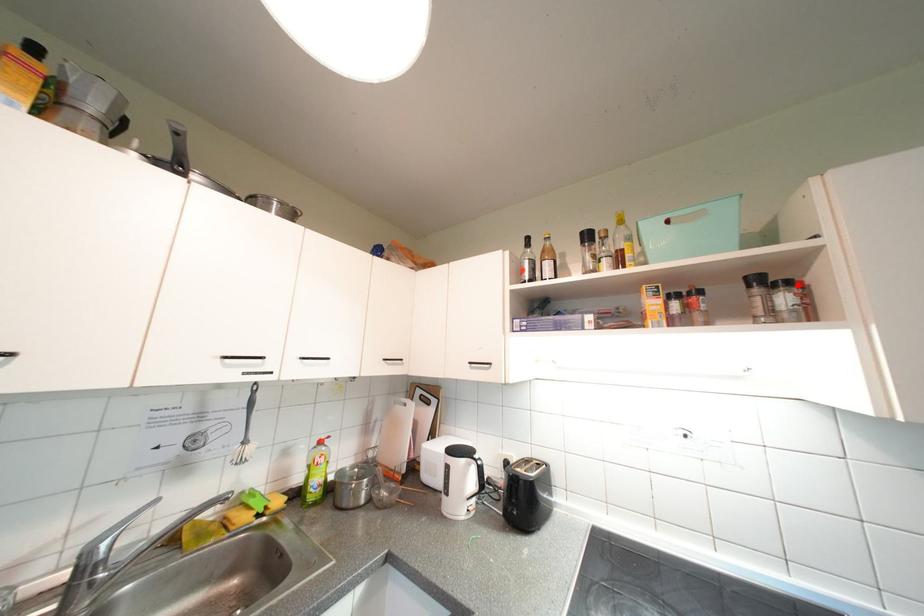
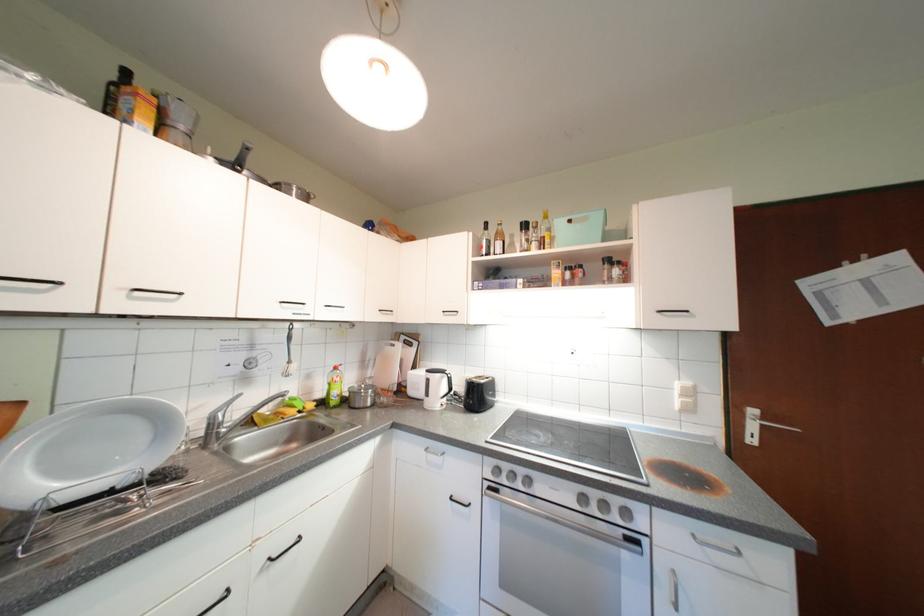
Locate, in the second image, the point that corresponds to the highlighted location in the first image.

(627, 265)